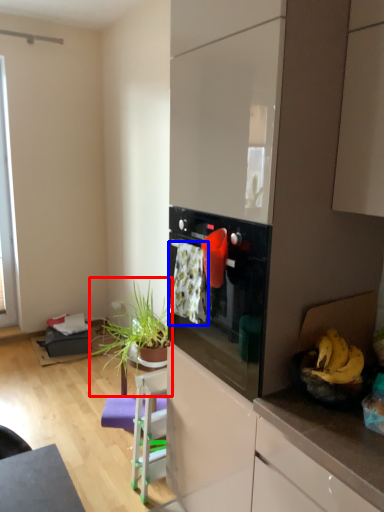
Question: Which object is further to the camera taking this photo, houseplant (highlighted by a red box) or laundry (highlighted by a blue box)?

Choices:
 (A) houseplant
 (B) laundry

Answer: (A)